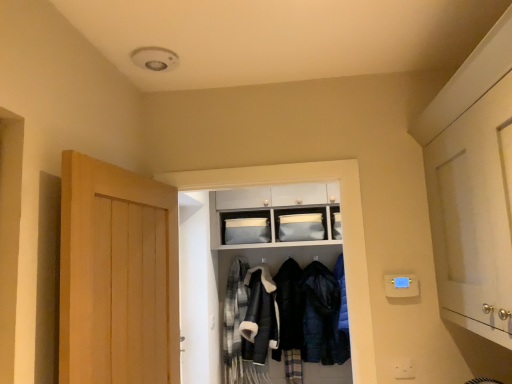
You are a GUI agent. You are given a task and a screenshot of the screen. Output one action in this format:
    pyautogui.click(x=<x>, y=<y>)
    Task: Click on the light brown wooden door at left, the 2th door positioned from the right
    This screenshot has height=384, width=512.
    Given the screenshot: What is the action you would take?
    pyautogui.click(x=116, y=269)

Where is `matte gray fabric storage at upper center`? matte gray fabric storage at upper center is located at coordinates (245, 227).

This screenshot has width=512, height=384. What are the coordinates of `fluffy wool scarf at center, marked as the 4th clothing in a right-to-left arrangement` in the screenshot? It's located at (234, 326).

Measure the distance between fluffy wool scarf at center, marked as the 4th clothing in a right-to-left arrangement, and camera.

The depth of fluffy wool scarf at center, marked as the 4th clothing in a right-to-left arrangement, is 3.49 meters.

This screenshot has height=384, width=512. What do you see at coordinates (289, 307) in the screenshot?
I see `black fuzzy coat at center, the 2th clothing viewed from the right` at bounding box center [289, 307].

What is the approximate width of white glossy cabinet at right, placed as the 2th door when sorted from left to right?

The width of white glossy cabinet at right, placed as the 2th door when sorted from left to right, is 15.75 inches.

Describe the element at coordinates (274, 225) in the screenshot. The height and width of the screenshot is (384, 512). I see `white fabric coat at center` at that location.

You are a GUI agent. You are given a task and a screenshot of the screen. Output one action in this format:
    pyautogui.click(x=<x>, y=<y>)
    Task: Click on the light brown wooden door at left, the first door when ordered from left to right
    This screenshot has height=384, width=512.
    Given the screenshot: What is the action you would take?
    pyautogui.click(x=116, y=269)

Is black fuzzy coat at center, the third clothing in the left-to-right sequence, behind white fabric coat at center?

Yes, black fuzzy coat at center, the third clothing in the left-to-right sequence, is further from the camera.

Which is more to the left, black fuzzy coat at center, the 2th clothing viewed from the right, or white fabric coat at center?

From the viewer's perspective, white fabric coat at center appears more on the left side.

Is black fuzzy coat at center, the third clothing in the left-to-right sequence, facing away from white fabric coat at center?

Absolutely, black fuzzy coat at center, the third clothing in the left-to-right sequence, is directed away from white fabric coat at center.

From a real-world perspective, is black fuzzy coat at center, the third clothing in the left-to-right sequence, located beneath white fabric coat at center?

Yes, from a real-world perspective, black fuzzy coat at center, the third clothing in the left-to-right sequence, is below white fabric coat at center.

Who is bigger, dark blue quilted jacket at center, the 1th clothing in the right-to-left sequence, or light brown wooden door at left, the 2th door positioned from the right?

With larger size is light brown wooden door at left, the 2th door positioned from the right.

From the image's perspective, would you say dark blue quilted jacket at center, which is the fourth clothing in left-to-right order, is positioned over light brown wooden door at left, the first door when ordered from left to right?

Actually, dark blue quilted jacket at center, which is the fourth clothing in left-to-right order, appears below light brown wooden door at left, the first door when ordered from left to right, in the image.

Between dark blue quilted jacket at center, which is the fourth clothing in left-to-right order, and light brown wooden door at left, the 2th door positioned from the right, which one has smaller width?

light brown wooden door at left, the 2th door positioned from the right.

Is dark blue quilted jacket at center, the 1th clothing in the right-to-left sequence, looking in the opposite direction of light brown wooden door at left, the first door when ordered from left to right?

No, light brown wooden door at left, the first door when ordered from left to right, is not at the back of dark blue quilted jacket at center, the 1th clothing in the right-to-left sequence.

Considering the positions of objects light brown wooden door at left, the first door when ordered from left to right, and black fuzzy coat at center, the third clothing in the left-to-right sequence, in the image provided, who is more to the left, light brown wooden door at left, the first door when ordered from left to right, or black fuzzy coat at center, the third clothing in the left-to-right sequence,?

light brown wooden door at left, the first door when ordered from left to right, is more to the left.

Looking at this image, considering the relative sizes of light brown wooden door at left, the first door when ordered from left to right, and black fuzzy coat at center, the 2th clothing viewed from the right, in the image provided, is light brown wooden door at left, the first door when ordered from left to right, thinner than black fuzzy coat at center, the 2th clothing viewed from the right,?

Correct, the width of light brown wooden door at left, the first door when ordered from left to right, is less than that of black fuzzy coat at center, the 2th clothing viewed from the right.

Does light brown wooden door at left, the 2th door positioned from the right, have a larger size compared to black fuzzy coat at center, the 2th clothing viewed from the right?

Yes, light brown wooden door at left, the 2th door positioned from the right, is bigger than black fuzzy coat at center, the 2th clothing viewed from the right.

Does light brown wooden door at left, the 2th door positioned from the right, contain black fuzzy coat at center, the 2th clothing viewed from the right?

No, black fuzzy coat at center, the 2th clothing viewed from the right, is located outside of light brown wooden door at left, the 2th door positioned from the right.

From the image's perspective, does white glossy cabinet at right, placed as the 2th door when sorted from left to right, appear lower than dark blue quilted jacket at center, the 1th clothing in the right-to-left sequence?

Incorrect, from the image's perspective, white glossy cabinet at right, placed as the 2th door when sorted from left to right, is higher than dark blue quilted jacket at center, the 1th clothing in the right-to-left sequence.

Does white glossy cabinet at right, placed as the 2th door when sorted from left to right, touch dark blue quilted jacket at center, the 1th clothing in the right-to-left sequence?

They are not placed beside each other.

At what (x,y) coordinates should I click in order to perform the action: click on the 2nd clothing directly beneath the white glossy cabinet at right, placed as the 2th door when sorted from left to right (from a real-world perspective). Please return your answer as a coordinate pair (x, y). The height and width of the screenshot is (384, 512). Looking at the image, I should click on (322, 317).

From a real-world perspective, which object rests below the other?

In real-world perspective, dark blue quilted jacket at center, the 1th clothing in the right-to-left sequence, is lower.

Can you tell me how much white fabric coat at center and leather jacket at center, marked as the second clothing in a left-to-right arrangement, differ in facing direction?

The facing directions of white fabric coat at center and leather jacket at center, marked as the second clothing in a left-to-right arrangement, are 0.114 degrees apart.

Is white fabric coat at center oriented away from leather jacket at center, marked as the second clothing in a left-to-right arrangement?

Yes, white fabric coat at center's orientation is away from leather jacket at center, marked as the second clothing in a left-to-right arrangement.

Considering their positions, is white fabric coat at center located in front of or behind leather jacket at center, arranged as the 3th clothing when viewed from the right?

Visually, white fabric coat at center is located in front of leather jacket at center, arranged as the 3th clothing when viewed from the right.

In the image, is white fabric coat at center on the left side or the right side of leather jacket at center, marked as the second clothing in a left-to-right arrangement?

Based on their positions, white fabric coat at center is located to the right of leather jacket at center, marked as the second clothing in a left-to-right arrangement.

Is light brown wooden door at left, the first door when ordered from left to right, to the left or to the right of matte gray fabric storage at upper center in the image?

Based on their positions, light brown wooden door at left, the first door when ordered from left to right, is located to the left of matte gray fabric storage at upper center.

The image size is (512, 384). Find the location of `shelf on the right of light brown wooden door at left, the first door when ordered from left to right`. shelf on the right of light brown wooden door at left, the first door when ordered from left to right is located at coordinates (245, 227).

Between light brown wooden door at left, the first door when ordered from left to right, and matte gray fabric storage at upper center, which one has larger width?

With larger width is light brown wooden door at left, the first door when ordered from left to right.

Is matte gray fabric storage at upper center turned away from dark blue quilted jacket at center, which is the fourth clothing in left-to-right order?

matte gray fabric storage at upper center does not have its back to dark blue quilted jacket at center, which is the fourth clothing in left-to-right order.

From a real-world perspective, between matte gray fabric storage at upper center and dark blue quilted jacket at center, which is the fourth clothing in left-to-right order, who is vertically higher?

matte gray fabric storage at upper center.

Considering the relative sizes of matte gray fabric storage at upper center and dark blue quilted jacket at center, the 1th clothing in the right-to-left sequence, in the image provided, is matte gray fabric storage at upper center smaller than dark blue quilted jacket at center, the 1th clothing in the right-to-left sequence,?

Correct, matte gray fabric storage at upper center occupies less space than dark blue quilted jacket at center, the 1th clothing in the right-to-left sequence.

Can you tell me how much matte gray fabric storage at upper center and dark blue quilted jacket at center, the 1th clothing in the right-to-left sequence, differ in facing direction?

There is a 0.764-degree angle between the facing directions of matte gray fabric storage at upper center and dark blue quilted jacket at center, the 1th clothing in the right-to-left sequence.

Where is `the 3rd clothing below the white fabric coat at center (from the image's perspective)`? the 3rd clothing below the white fabric coat at center (from the image's perspective) is located at coordinates (289, 307).

Find the location of a particular element. The image size is (512, 384). door on the left of dark blue quilted jacket at center, which is the fourth clothing in left-to-right order is located at coordinates (116, 269).

Looking at the image, which one is located closer to black fuzzy coat at center, the 2th clothing viewed from the right, leather jacket at center, arranged as the 3th clothing when viewed from the right, or white glossy cabinet at right, positioned as the first door in right-to-left order?

leather jacket at center, arranged as the 3th clothing when viewed from the right, lies closer to black fuzzy coat at center, the 2th clothing viewed from the right, than the other object.

From the image, which object appears to be nearer to black fuzzy coat at center, the third clothing in the left-to-right sequence, fluffy wool scarf at center, marked as the 4th clothing in a right-to-left arrangement, or matte gray fabric storage at upper center?

Among the two, fluffy wool scarf at center, marked as the 4th clothing in a right-to-left arrangement, is located nearer to black fuzzy coat at center, the third clothing in the left-to-right sequence.

Which object lies further to the anchor point matte gray fabric storage at upper center, light brown wooden door at left, the first door when ordered from left to right, or white glossy cabinet at right, positioned as the first door in right-to-left order?

white glossy cabinet at right, positioned as the first door in right-to-left order, lies further to matte gray fabric storage at upper center than the other object.

Looking at the image, which one is located closer to leather jacket at center, marked as the second clothing in a left-to-right arrangement, fluffy wool scarf at center, acting as the first clothing starting from the left, or matte gray fabric storage at upper center?

Based on the image, fluffy wool scarf at center, acting as the first clothing starting from the left, appears to be nearer to leather jacket at center, marked as the second clothing in a left-to-right arrangement.

Looking at the image, which one is located further to white fabric coat at center, fluffy wool scarf at center, marked as the 4th clothing in a right-to-left arrangement, or dark blue quilted jacket at center, which is the fourth clothing in left-to-right order?

The object further to white fabric coat at center is dark blue quilted jacket at center, which is the fourth clothing in left-to-right order.

Which object lies further to the anchor point matte gray fabric storage at upper center, leather jacket at center, marked as the second clothing in a left-to-right arrangement, or black fuzzy coat at center, the 2th clothing viewed from the right?

black fuzzy coat at center, the 2th clothing viewed from the right, is further to matte gray fabric storage at upper center.

Consider the image. When comparing their distances from leather jacket at center, arranged as the 3th clothing when viewed from the right, does black fuzzy coat at center, the 2th clothing viewed from the right, or light brown wooden door at left, the first door when ordered from left to right, seem closer?

Based on the image, black fuzzy coat at center, the 2th clothing viewed from the right, appears to be nearer to leather jacket at center, arranged as the 3th clothing when viewed from the right.

Looking at the image, which one is located further to dark blue quilted jacket at center, which is the fourth clothing in left-to-right order, white glossy cabinet at right, positioned as the first door in right-to-left order, or white fabric coat at center?

white glossy cabinet at right, positioned as the first door in right-to-left order.

Locate an element on the screen. This screenshot has height=384, width=512. clothing located between leather jacket at center, marked as the second clothing in a left-to-right arrangement, and dark blue quilted jacket at center, which is the fourth clothing in left-to-right order, in the left-right direction is located at coordinates (289, 307).

This screenshot has width=512, height=384. I want to click on closet that lies between matte gray fabric storage at upper center and dark blue quilted jacket at center, which is the fourth clothing in left-to-right order, from top to bottom, so click(274, 225).

The image size is (512, 384). Find the location of `closet between white glossy cabinet at right, positioned as the first door in right-to-left order, and matte gray fabric storage at upper center in the front-back direction`. closet between white glossy cabinet at right, positioned as the first door in right-to-left order, and matte gray fabric storage at upper center in the front-back direction is located at coordinates (274, 225).

Where is `closet positioned between light brown wooden door at left, the first door when ordered from left to right, and fluffy wool scarf at center, acting as the first clothing starting from the left, from near to far`? closet positioned between light brown wooden door at left, the first door when ordered from left to right, and fluffy wool scarf at center, acting as the first clothing starting from the left, from near to far is located at coordinates (274, 225).